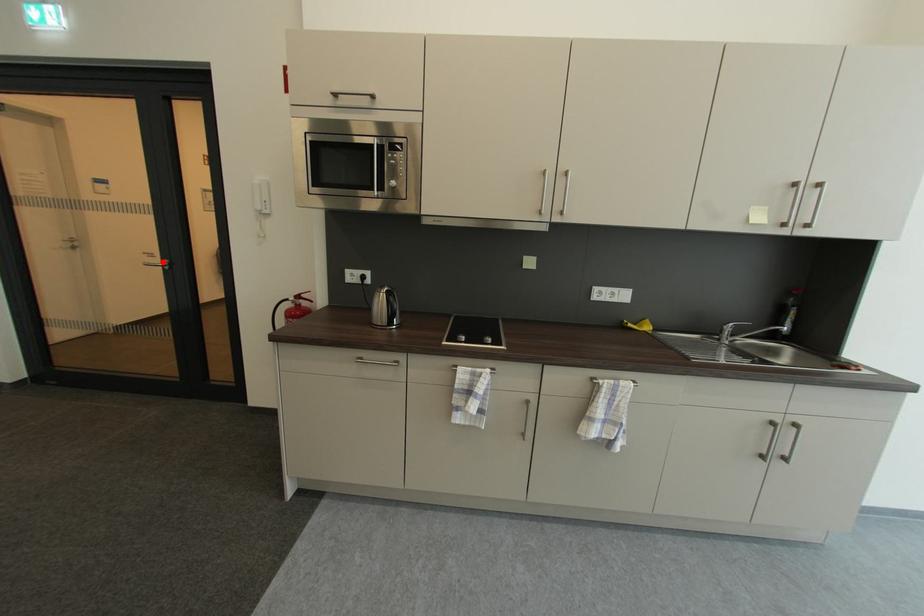
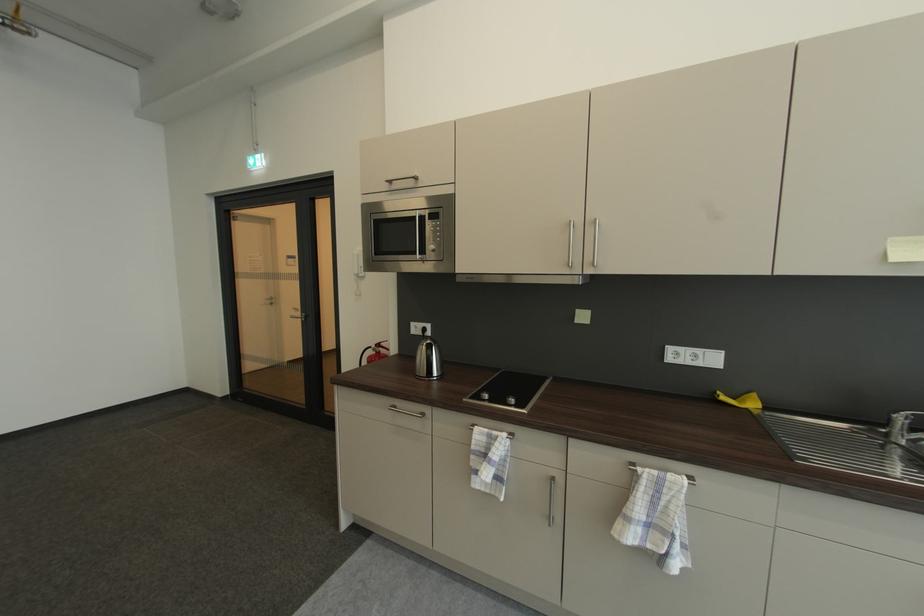
Where in the second image is the point corresponding to the highlighted location from the first image?

(305, 315)